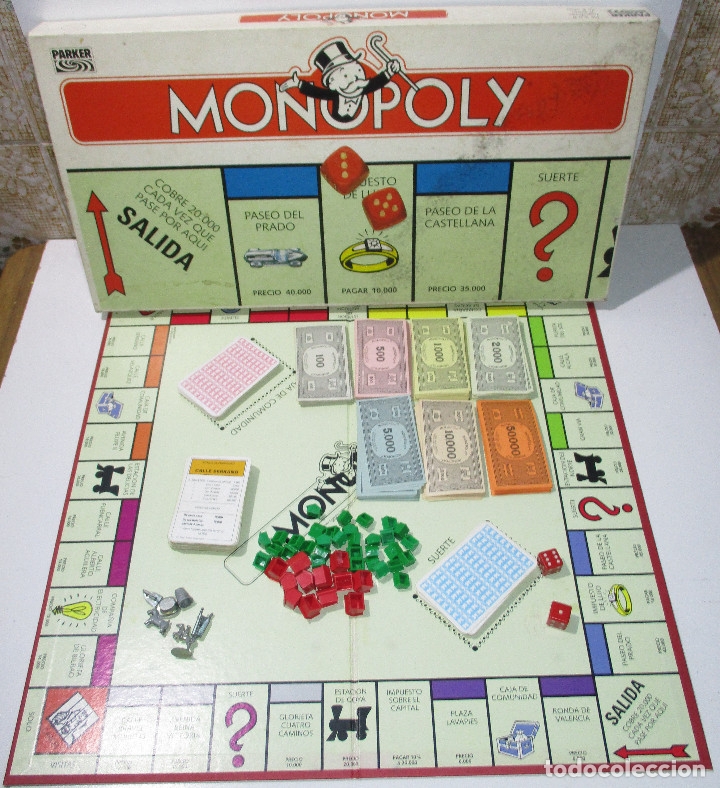
Find the location of a particular element. The width and height of the screenshot is (720, 788). stacks of monopoly money is located at coordinates (314, 351), (364, 351), (423, 359), (500, 355), (513, 425), (459, 430), (382, 433).